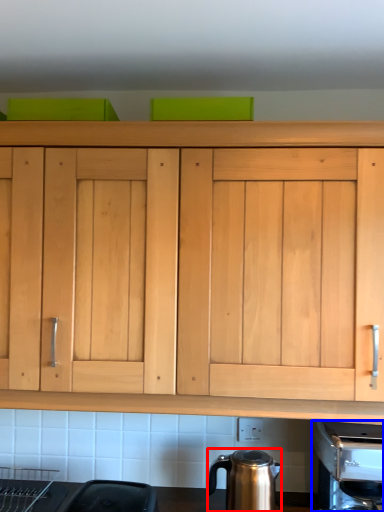
Question: Which object appears farthest to the camera in this image, kitchen appliance (highlighted by a red box) or coffee machine (highlighted by a blue box)?

Choices:
 (A) kitchen appliance
 (B) coffee machine

Answer: (A)